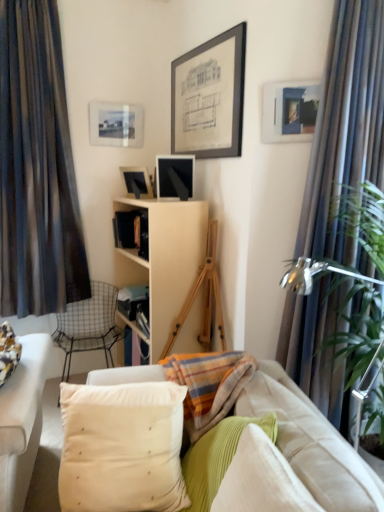
Question: Is green corduroy pillow at center, the 2th pillow when ordered from left to right, wider or thinner than silky blue curtain at right, acting as the first curtain starting from the right?

Choices:
 (A) wide
 (B) thin

Answer: (B)

Question: Based on their sizes in the image, would you say green corduroy pillow at center, which is the 2th pillow from right to left, is bigger or smaller than silky blue curtain at right, acting as the first curtain starting from the right?

Choices:
 (A) small
 (B) big

Answer: (A)

Question: Estimate the real-world distances between objects in this image. Which object is closer to the matte black picture frame at upper center, which is the 2th picture frame from back to front?

Choices:
 (A) green corduroy pillow at center, the 2th pillow when ordered from left to right
 (B) corduroy fabric pillow at lower right, which is the third pillow in left-to-right order
 (C) white soft pillow at center, which is counted as the 3th pillow, starting from the right
 (D) matte glass picture frame at upper center, the first picture frame when ordered from back to front
 (E) wooden easel at center

Answer: (D)

Question: Estimate the real-world distances between objects in this image. Which object is closer to the matte blue picture frame at upper right, which ranks as the third picture frame in back-to-front order?

Choices:
 (A) wooden easel at center
 (B) black matte bookshelf at center
 (C) green leafy plant at right
 (D) soft beige fabric couch at center
 (E) white soft pillow at center, which ranks as the first pillow in left-to-right order

Answer: (C)